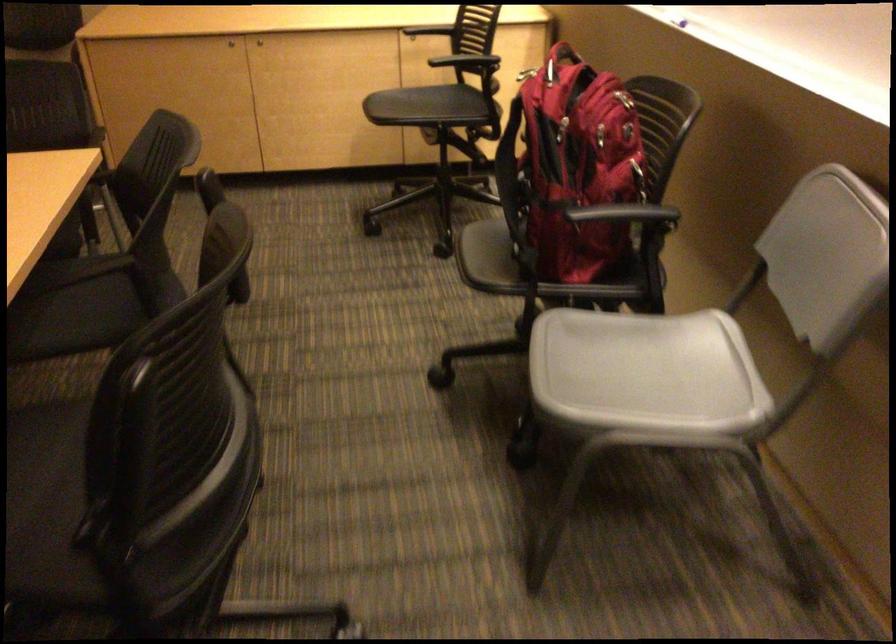
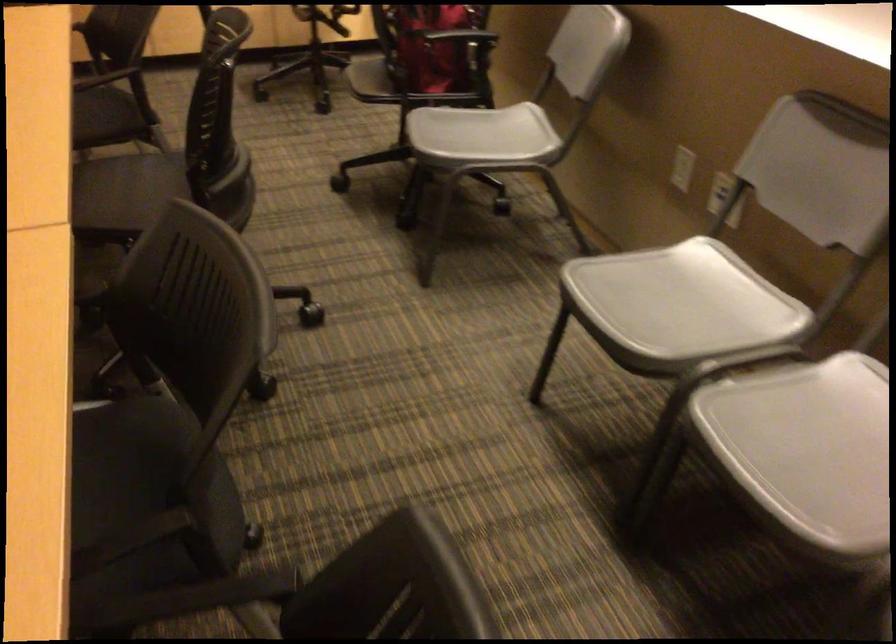
The point at (642, 371) is marked in the first image. Where is the corresponding point in the second image?

(481, 136)